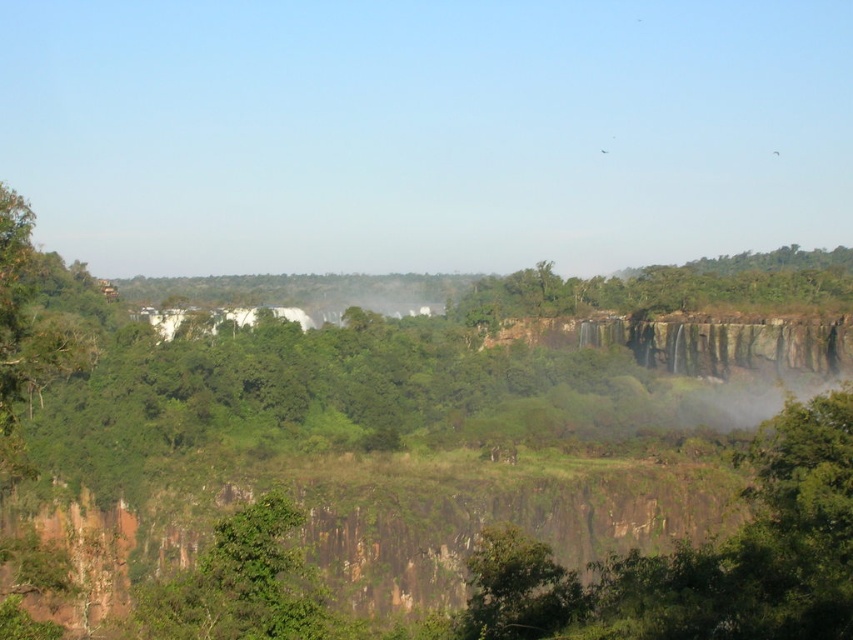
You are an environmental scientist assessing the health of this landscape. You observe the green leafy tree at upper center and the green leafy tree at center. Which tree has a larger width?

The green leafy tree at upper center has a larger width than the green leafy tree at center according to the description.

You are a hiker standing at the base of the cliffs in this landscape. You spot two points marked in the scene. Which point, point (701, 275) or point (338, 627), is closer to your current position?

Point (701, 275) is closer to your current position because it is further to the viewer than point (338, 627).

You are a hiker standing at the base of the cliffs in the foreground of the image. You see the green leafy tree at upper center and the green leafy tree at center. Which tree is higher in the scene?

The green leafy tree at upper center is higher in the scene because it is positioned above the green leafy tree at center.